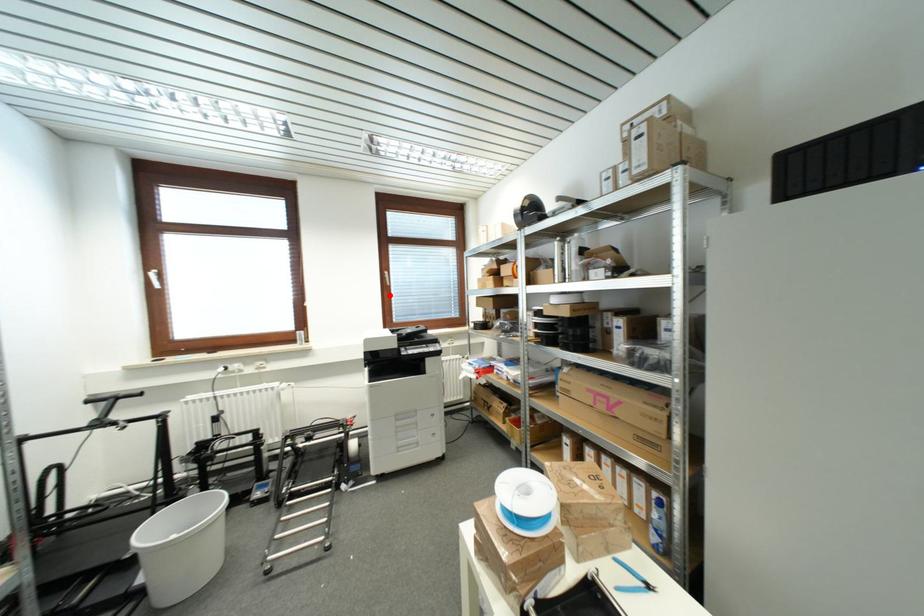
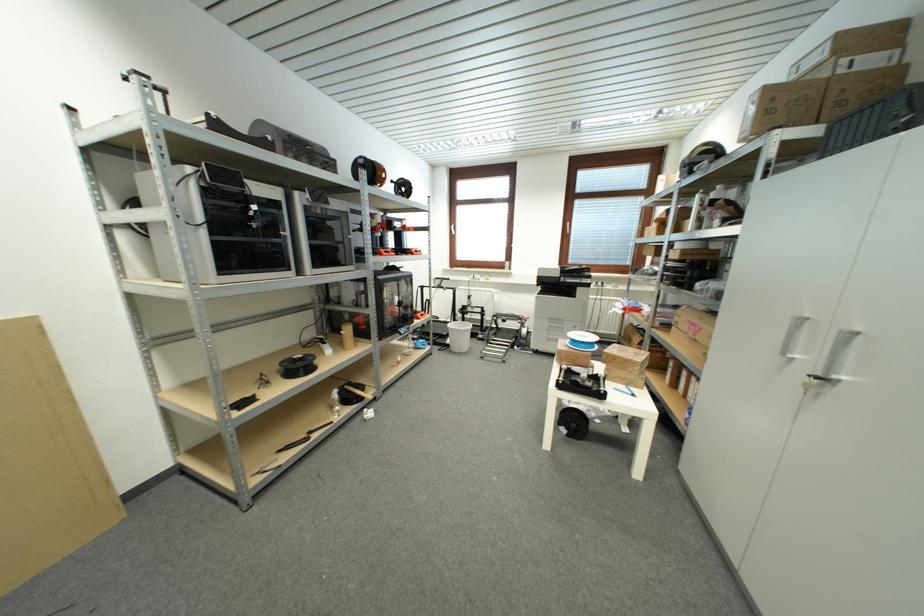
Locate, in the second image, the point that corresponds to the highlighted location in the first image.

(569, 241)